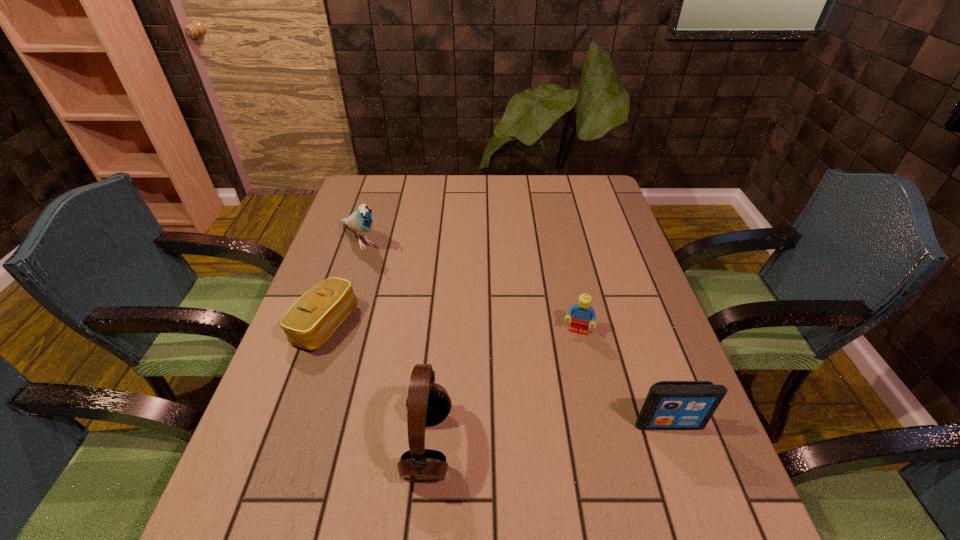
Image resolution: width=960 pixels, height=540 pixels. Identify the location of object positioned at the right edge. (670, 405).

In the image, there is a desktop. Where is `vacant space at the far edge`? Image resolution: width=960 pixels, height=540 pixels. vacant space at the far edge is located at coordinates (527, 192).

In the image, there is a desktop. Where is `vacant space at the near edge`? vacant space at the near edge is located at coordinates (522, 451).

This screenshot has width=960, height=540. Identify the location of vacant space at the left edge. (329, 373).

Locate an element on the screen. The image size is (960, 540). blank space at the right edge of the desktop is located at coordinates (675, 354).

I want to click on vacant area at the far left corner of the desktop, so click(383, 188).

The height and width of the screenshot is (540, 960). I want to click on blank space at the near right corner of the desktop, so click(x=695, y=454).

The width and height of the screenshot is (960, 540). I want to click on free space that is in between the Lego and the rightmost object, so click(623, 378).

Find the location of a particular element. vacant area between the second object from right to left and the shortest object is located at coordinates (451, 329).

Where is `free space that is in between the third object from left to right and the rightmost object`? The height and width of the screenshot is (540, 960). free space that is in between the third object from left to right and the rightmost object is located at coordinates (548, 435).